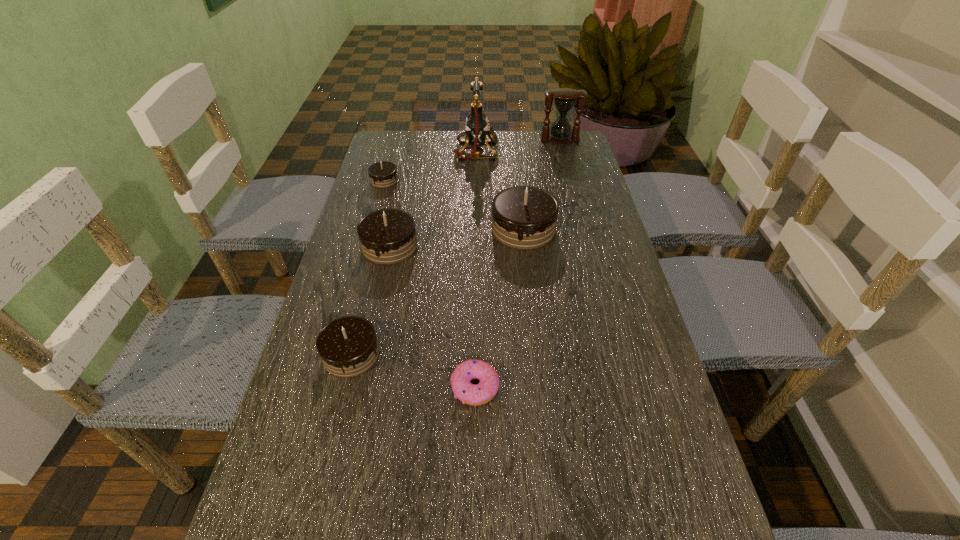
Where is `free space at the far right corner`? free space at the far right corner is located at coordinates (584, 162).

You are a GUI agent. You are given a task and a screenshot of the screen. Output one action in this format:
    pyautogui.click(x=<x>, y=<y>)
    Task: Click on the free point between the smallest chocolate chocolate cake and the telephone
    The image size is (960, 540).
    Given the screenshot: What is the action you would take?
    (x=430, y=166)

The width and height of the screenshot is (960, 540). I want to click on empty space between the sixth tallest object and the brown hourglass, so click(472, 160).

The width and height of the screenshot is (960, 540). Identify the location of vacant space that's between the smallest chocolate chocolate cake and the telephone. (430, 166).

This screenshot has width=960, height=540. Identify the location of vacant area that lies between the rightmost chocolate chocolate cake and the telephone. (500, 191).

Where is `unoccupied position between the third smallest chocolate chocolate cake and the doughnut`? This screenshot has width=960, height=540. unoccupied position between the third smallest chocolate chocolate cake and the doughnut is located at coordinates (432, 316).

You are a GUI agent. You are given a task and a screenshot of the screen. Output one action in this format:
    pyautogui.click(x=<x>, y=<y>)
    Task: Click on the unoccupied area between the fifth shortest object and the smallest chocolate chocolate cake
    
    Given the screenshot: What is the action you would take?
    pyautogui.click(x=368, y=267)

Locate an element on the screen. Image resolution: width=960 pixels, height=540 pixels. free space between the rightmost object and the second smallest chocolate chocolate cake is located at coordinates (456, 247).

Identify the location of object that is the seventh closest to the third shortest object. The width and height of the screenshot is (960, 540). (477, 127).

Where is `object that is the second closest to the tallest chocolate cake`? This screenshot has height=540, width=960. object that is the second closest to the tallest chocolate cake is located at coordinates (477, 127).